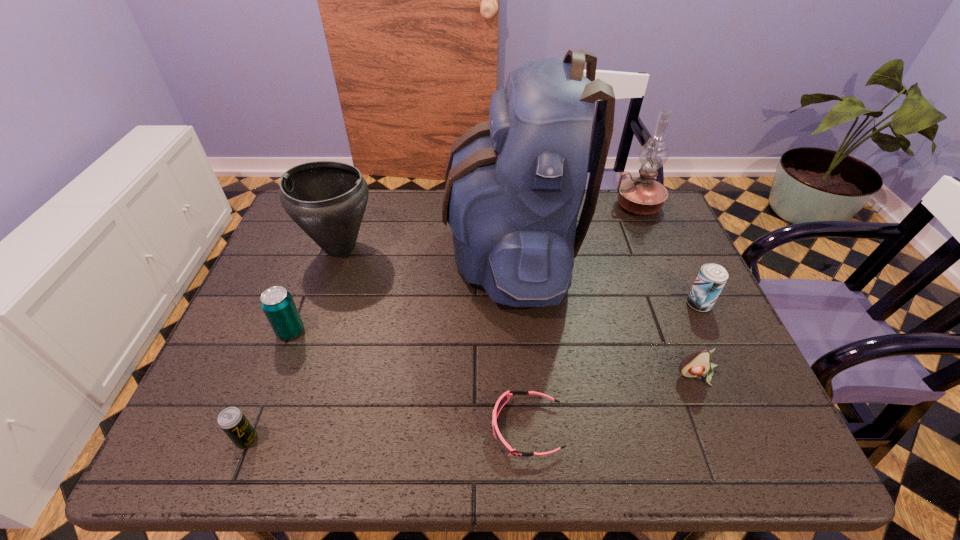
Find the location of a particular element. The image size is (960, 540). object that is at the near left corner is located at coordinates (232, 421).

Where is `object that is positioned at the far right corner`? The height and width of the screenshot is (540, 960). object that is positioned at the far right corner is located at coordinates (641, 195).

Where is `free space at the far edge of the desktop`? This screenshot has height=540, width=960. free space at the far edge of the desktop is located at coordinates (396, 205).

At what (x,y) coordinates should I click in order to perform the action: click on free space at the near edge of the desktop. Please return your answer as a coordinate pair (x, y). Looking at the image, I should click on (456, 450).

This screenshot has width=960, height=540. Identify the location of free space at the left edge of the desktop. (283, 260).

This screenshot has width=960, height=540. Find the location of `blank space at the right edge`. blank space at the right edge is located at coordinates (694, 311).

The height and width of the screenshot is (540, 960). In order to click on vacant space at the near left corner in this screenshot , I will do `click(236, 460)`.

At what (x,y) coordinates should I click in order to perform the action: click on free space at the far right corner of the desktop. Please return your answer as a coordinate pair (x, y). The height and width of the screenshot is (540, 960). Looking at the image, I should click on (627, 235).

The image size is (960, 540). Find the location of `free spot between the goggles and the shortest beer can`. free spot between the goggles and the shortest beer can is located at coordinates (387, 434).

At what (x,y) coordinates should I click in order to perform the action: click on free space between the avocado and the third tallest object. Please return your answer as a coordinate pair (x, y). This screenshot has height=540, width=960. Looking at the image, I should click on (518, 312).